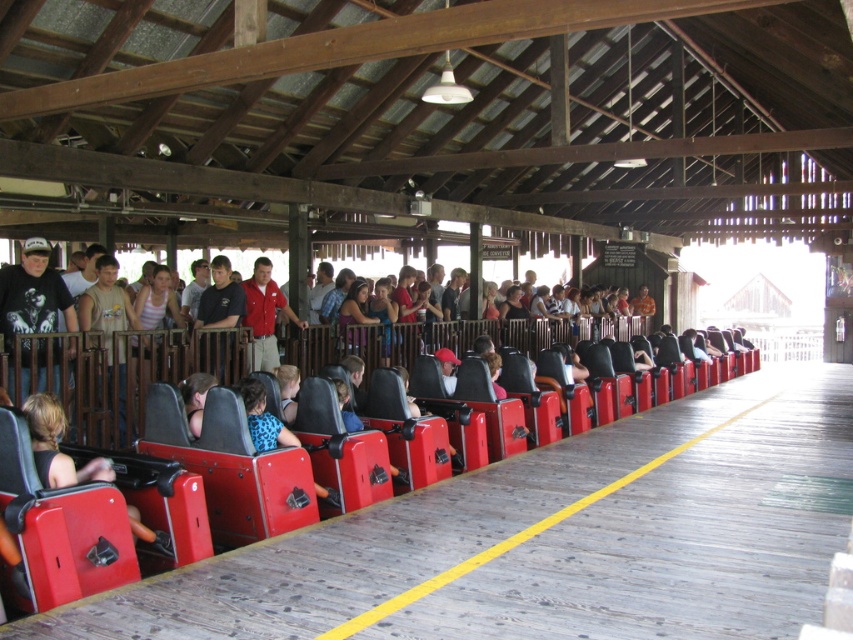
Question: Which object is the farthest from the matte black seat at center?

Choices:
 (A) red cotton shirt at center
 (B) matte black t-shirt at left

Answer: (A)

Question: Which point appears farthest from the camera in this image?

Choices:
 (A) (6, 314)
 (B) (300, 321)
 (C) (56, 474)

Answer: (B)

Question: Is matte black seat at center bigger than red cotton shirt at center?

Choices:
 (A) yes
 (B) no

Answer: (B)

Question: Is matte black seat at center positioned in front of red cotton shirt at center?

Choices:
 (A) no
 (B) yes

Answer: (B)

Question: Is matte black t-shirt at left wider than red cotton shirt at center?

Choices:
 (A) yes
 (B) no

Answer: (B)

Question: Which point is farther to the camera?

Choices:
 (A) matte black seat at center
 (B) matte black t-shirt at left
 (C) red cotton shirt at center

Answer: (C)